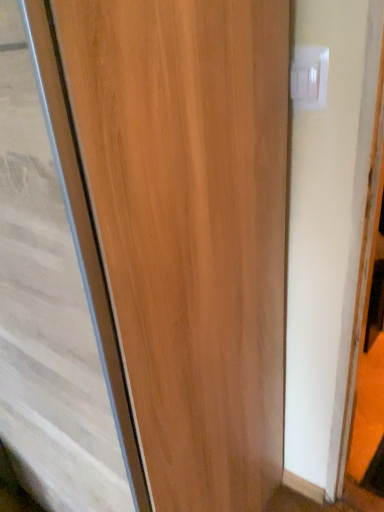
Question: Is wooden door at center closer to camera compared to white plastic electric outlet at upper right?

Choices:
 (A) no
 (B) yes

Answer: (B)

Question: From a real-world perspective, is wooden door at center positioned under white plastic electric outlet at upper right based on gravity?

Choices:
 (A) yes
 (B) no

Answer: (A)

Question: From the image's perspective, is wooden door at center under white plastic electric outlet at upper right?

Choices:
 (A) no
 (B) yes

Answer: (B)

Question: From the image's perspective, would you say wooden door at center is positioned over white plastic electric outlet at upper right?

Choices:
 (A) no
 (B) yes

Answer: (A)

Question: Can you see wooden door at center touching white plastic electric outlet at upper right?

Choices:
 (A) no
 (B) yes

Answer: (A)

Question: Does wooden door at center have a lesser width compared to white plastic electric outlet at upper right?

Choices:
 (A) no
 (B) yes

Answer: (A)

Question: Does white plastic electric outlet at upper right have a greater height compared to wooden door at center?

Choices:
 (A) yes
 (B) no

Answer: (B)

Question: Does white plastic electric outlet at upper right come in front of wooden door at center?

Choices:
 (A) no
 (B) yes

Answer: (A)

Question: From a real-world perspective, is white plastic electric outlet at upper right positioned over wooden door at center based on gravity?

Choices:
 (A) yes
 (B) no

Answer: (A)

Question: From the image's perspective, is white plastic electric outlet at upper right above wooden door at center?

Choices:
 (A) yes
 (B) no

Answer: (A)

Question: Considering the relative sizes of white plastic electric outlet at upper right and wooden door at center in the image provided, is white plastic electric outlet at upper right bigger than wooden door at center?

Choices:
 (A) no
 (B) yes

Answer: (A)

Question: Considering the relative sizes of white plastic electric outlet at upper right and wooden door at center in the image provided, is white plastic electric outlet at upper right shorter than wooden door at center?

Choices:
 (A) no
 (B) yes

Answer: (B)

Question: Based on their sizes in the image, would you say wooden door at center is bigger or smaller than white plastic electric outlet at upper right?

Choices:
 (A) big
 (B) small

Answer: (A)